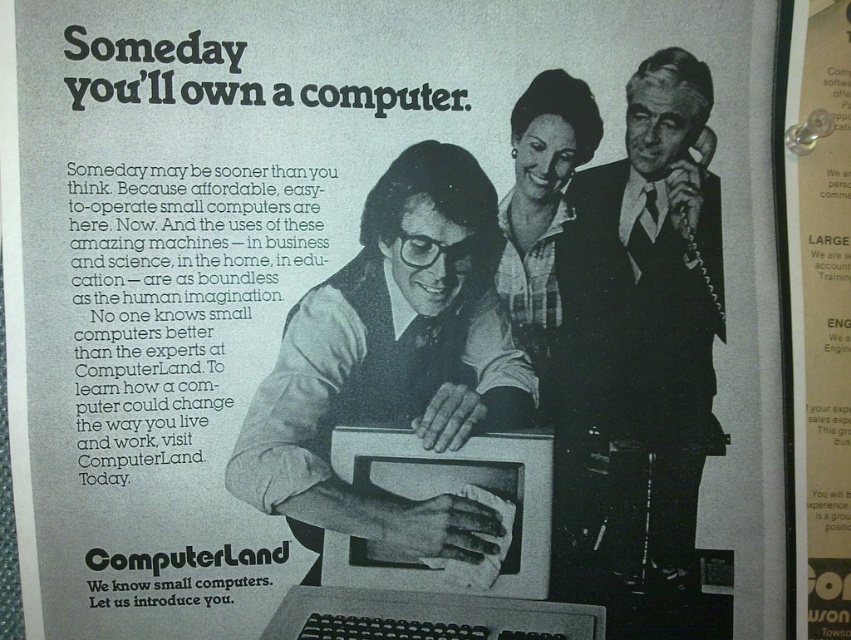
You are a technician who needs to connect a cable between the matte black computer at center and the satin black suit at upper right. The cable you have is 10 centimeters long. Is the cable long enough?

The distance between the matte black computer at center and the satin black suit at upper right is 12.32 centimeters, so the 10 centimeter cable is not long enough.

Looking at this image, you are a customer entering the ComputerLand store and see the matte black computer at center and the satin black suit at upper right in the advertisement. Which object is closer to you based on their positions?

The matte black computer at center is closer to you because it is in front of the satin black suit at upper right.

Based on the scene described, which object occupies a more prominent position in terms of size between the matte black computer at center and the satin black suit at upper right?

The matte black computer at center has a larger size compared to the satin black suit at upper right, making it more prominent in terms of size.